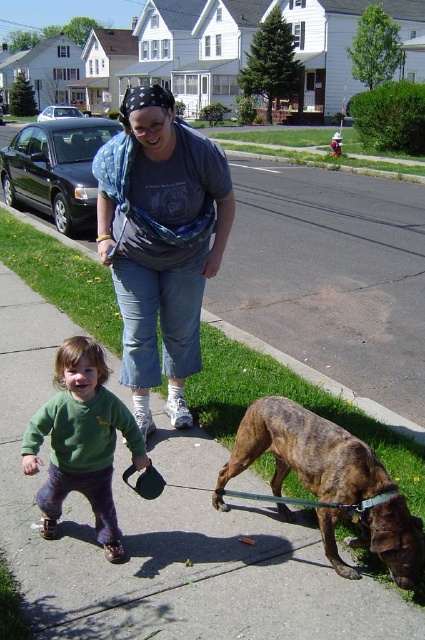
Question: Which of the following is the farthest from the observer?

Choices:
 (A) (113, 388)
 (B) (246, 420)

Answer: (A)

Question: Estimate the real-world distances between objects in this image. Which object is farther from the brindle fur dog at lower right?

Choices:
 (A) gray concrete sidewalk at lower center
 (B) matte gray t-shirt at center

Answer: (B)

Question: Is matte gray t-shirt at center below brindle fur dog at lower right?

Choices:
 (A) yes
 (B) no

Answer: (B)

Question: Which object appears closest to the camera in this image?

Choices:
 (A) green fuzzy sweater at center
 (B) gray concrete sidewalk at lower center

Answer: (B)

Question: Is matte gray t-shirt at center positioned at the back of brindle fur dog at lower right?

Choices:
 (A) yes
 (B) no

Answer: (A)

Question: Is gray concrete sidewalk at lower center in front of brindle fur dog at lower right?

Choices:
 (A) no
 (B) yes

Answer: (B)